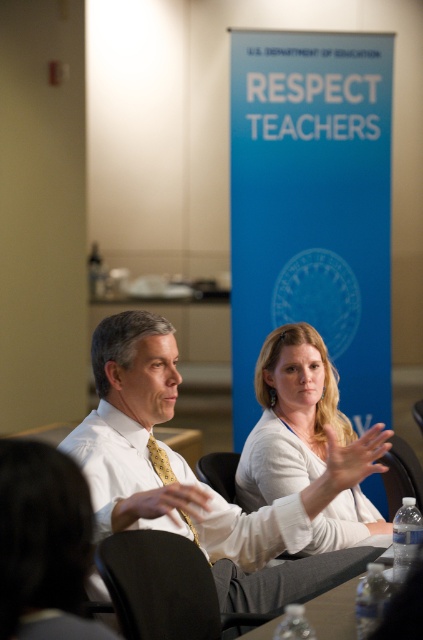
Does clear plastic water bottles at lower center appear on the left side of yellowtexturetie at center?

Incorrect, clear plastic water bottles at lower center is not on the left side of yellowtexturetie at center.

Describe the element at coordinates (334, 611) in the screenshot. I see `clear plastic water bottles at lower center` at that location.

The height and width of the screenshot is (640, 423). What are the coordinates of `clear plastic water bottles at lower center` in the screenshot? It's located at (x=334, y=611).

Can you confirm if white matte shirt at center is taller than yellowtexturetie at center?

Yes, white matte shirt at center is taller than yellowtexturetie at center.

Does white matte shirt at center appear on the right side of yellowtexturetie at center?

Yes, white matte shirt at center is to the right of yellowtexturetie at center.

Between point (312, 419) and point (195, 540), which one is positioned in front?

Point (195, 540) is more forward.

You are a GUI agent. You are given a task and a screenshot of the screen. Output one action in this format:
    pyautogui.click(x=<x>, y=<y>)
    Task: Click on the white matte shirt at center
    Image resolution: width=423 pixels, height=640 pixels.
    Given the screenshot: What is the action you would take?
    pyautogui.click(x=291, y=417)

Who is lower down, white matte shirt at center or clear plastic water bottles at lower center?

clear plastic water bottles at lower center is lower down.

Does white matte shirt at center have a larger size compared to clear plastic water bottles at lower center?

Indeed, white matte shirt at center has a larger size compared to clear plastic water bottles at lower center.

Is point (244, 486) farther from viewer compared to point (324, 632)?

Yes, it is.

Locate an element on the screen. The height and width of the screenshot is (640, 423). white matte shirt at center is located at coordinates (291, 417).